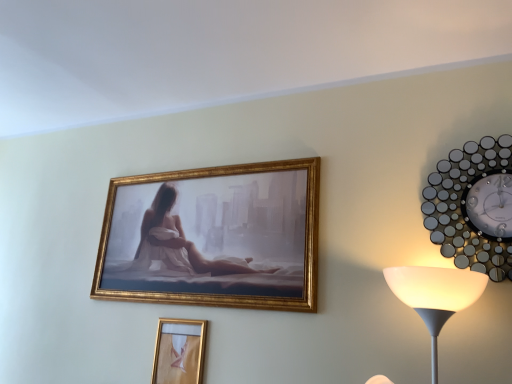
Describe the element at coordinates (473, 206) in the screenshot. The image size is (512, 384). I see `metallic silver wall clock at right` at that location.

What is the approximate width of metallic silver wall clock at right?

The width of metallic silver wall clock at right is 2.36 inches.

At what (x,y) coordinates should I click in order to perform the action: click on metallic silver wall clock at right. Please return your answer as a coordinate pair (x, y). This screenshot has width=512, height=384. Looking at the image, I should click on (473, 206).

What do you see at coordinates (179, 351) in the screenshot? The height and width of the screenshot is (384, 512). I see `gold metallic picture frame at lower center` at bounding box center [179, 351].

Where is `gold metallic picture frame at lower center`? The width and height of the screenshot is (512, 384). gold metallic picture frame at lower center is located at coordinates (179, 351).

In order to face gold metallic picture frame at lower center, should I rotate leftwards or rightwards?

To align with it, rotate left about 9.986°.

Measure the distance between point (x=188, y=333) and camera.

Point (x=188, y=333) and camera are 1.70 meters apart from each other.

Locate an element on the screen. metallic silver wall clock at right is located at coordinates (473, 206).

Which object is positioned more to the left, metallic silver wall clock at right or gold metallic picture frame at lower center?

gold metallic picture frame at lower center is more to the left.

In the image, is metallic silver wall clock at right positioned in front of or behind gold metallic picture frame at lower center?

Visually, metallic silver wall clock at right is located in front of gold metallic picture frame at lower center.

Does point (496, 215) come closer to viewer compared to point (195, 353)?

Yes, it is in front of point (195, 353).

From the image's perspective, who appears lower, metallic silver wall clock at right or gold metallic picture frame at lower center?

gold metallic picture frame at lower center, from the image's perspective.

From a real-world perspective, is metallic silver wall clock at right positioned under gold metallic picture frame at lower center based on gravity?

No, from a real-world perspective, metallic silver wall clock at right is not beneath gold metallic picture frame at lower center.

Which object is wider, metallic silver wall clock at right or gold metallic picture frame at lower center?

Wider between the two is metallic silver wall clock at right.

Does metallic silver wall clock at right have a greater height compared to gold metallic picture frame at lower center?

Correct, metallic silver wall clock at right is much taller as gold metallic picture frame at lower center.

Which of these two, metallic silver wall clock at right or gold metallic picture frame at lower center, is smaller?

With smaller size is gold metallic picture frame at lower center.

Is gold metallic picture frame at lower center inside metallic silver wall clock at right?

Definitely not — gold metallic picture frame at lower center is not inside metallic silver wall clock at right.

Is metallic silver wall clock at right next to gold metallic picture frame at lower center?

No, metallic silver wall clock at right is not beside gold metallic picture frame at lower center.

Is metallic silver wall clock at right oriented away from gold metallic picture frame at lower center?

No, metallic silver wall clock at right is not facing away from gold metallic picture frame at lower center.

What's the angular difference between metallic silver wall clock at right and gold metallic picture frame at lower center's facing directions?

The facing directions of metallic silver wall clock at right and gold metallic picture frame at lower center are 1.02 degrees apart.

In the scene shown: Could you measure the distance between metallic silver wall clock at right and gold metallic picture frame at lower center?

3.46 feet.

The width and height of the screenshot is (512, 384). I want to click on picture frame directly beneath the metallic silver wall clock at right (from a real-world perspective), so click(x=179, y=351).

Which object is positioned more to the right, gold metallic picture frame at lower center or metallic silver wall clock at right?

From the viewer's perspective, metallic silver wall clock at right appears more on the right side.

Is gold metallic picture frame at lower center in front of metallic silver wall clock at right?

No, gold metallic picture frame at lower center is further to the viewer.

Which is behind, point (196, 363) or point (486, 163)?

Positioned behind is point (196, 363).

From the image's perspective, is gold metallic picture frame at lower center on top of metallic silver wall clock at right?

No, from the image's perspective, gold metallic picture frame at lower center is not over metallic silver wall clock at right.

From a real-world perspective, is gold metallic picture frame at lower center under metallic silver wall clock at right?

Yes.

Between gold metallic picture frame at lower center and metallic silver wall clock at right, which one has larger width?

With larger width is metallic silver wall clock at right.

In terms of height, does gold metallic picture frame at lower center look taller or shorter compared to metallic silver wall clock at right?

Clearly, gold metallic picture frame at lower center is shorter compared to metallic silver wall clock at right.

Consider the image. Which of these two, gold metallic picture frame at lower center or metallic silver wall clock at right, is smaller?

Smaller between the two is gold metallic picture frame at lower center.

Is gold metallic picture frame at lower center located outside metallic silver wall clock at right?

Yes, gold metallic picture frame at lower center is located beyond the bounds of metallic silver wall clock at right.

Is gold metallic picture frame at lower center far from metallic silver wall clock at right?

Yes, gold metallic picture frame at lower center and metallic silver wall clock at right are quite far apart.

Is gold metallic picture frame at lower center oriented away from metallic silver wall clock at right?

No, gold metallic picture frame at lower center is not facing away from metallic silver wall clock at right.

What's the angular difference between gold metallic picture frame at lower center and metallic silver wall clock at right's facing directions?

1.02 degrees separate the facing orientations of gold metallic picture frame at lower center and metallic silver wall clock at right.

Locate an element on the screen. This screenshot has width=512, height=384. picture frame behind the metallic silver wall clock at right is located at coordinates (179, 351).

Where is `picture frame on the left side of metallic silver wall clock at right`? The height and width of the screenshot is (384, 512). picture frame on the left side of metallic silver wall clock at right is located at coordinates (179, 351).

In order to click on picture frame below the metallic silver wall clock at right (from a real-world perspective) in this screenshot , I will do `click(179, 351)`.